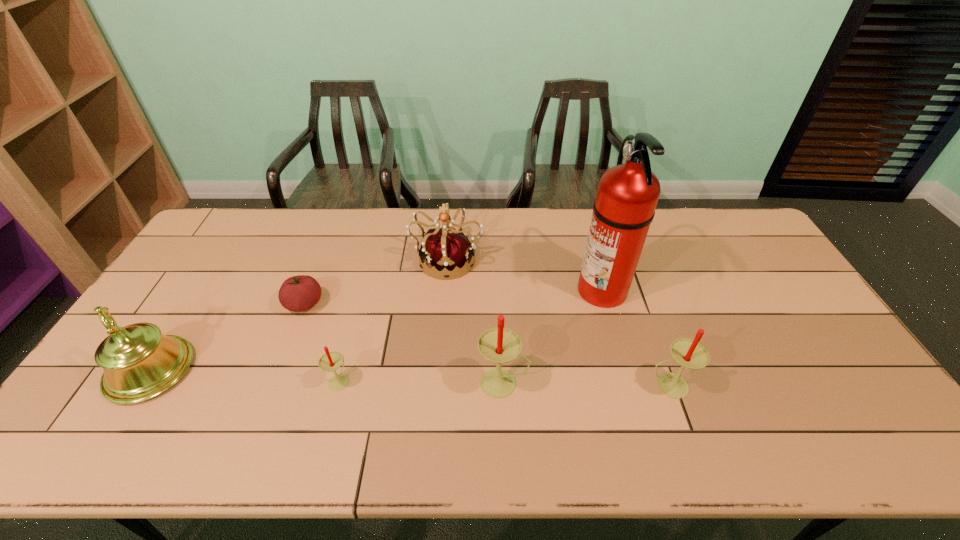
The height and width of the screenshot is (540, 960). Find the location of `vacant space that is in between the tiara and the fifth object from right to left`. vacant space that is in between the tiara and the fifth object from right to left is located at coordinates (394, 320).

This screenshot has height=540, width=960. I want to click on vacant area that lies between the second object from left to right and the third object from left to right, so click(322, 342).

At what (x,y) coordinates should I click in order to perform the action: click on vacant region between the fifth object from right to left and the tiara. Please return your answer as a coordinate pair (x, y). This screenshot has height=540, width=960. Looking at the image, I should click on (394, 320).

You are a GUI agent. You are given a task and a screenshot of the screen. Output one action in this format:
    pyautogui.click(x=<x>, y=<y>)
    Task: Click on the empty space between the second shortest object and the second candle from right to left
    This screenshot has width=960, height=540.
    Given the screenshot: What is the action you would take?
    pyautogui.click(x=421, y=382)

Find the location of a particular element. This screenshot has width=960, height=540. unoccupied position between the second tallest candle and the tiara is located at coordinates (558, 322).

You are a GUI agent. You are given a task and a screenshot of the screen. Output one action in this format:
    pyautogui.click(x=<x>, y=<y>)
    Task: Click on the free space between the rightmost candle and the bell
    Image resolution: width=960 pixels, height=540 pixels.
    Given the screenshot: What is the action you would take?
    pyautogui.click(x=410, y=378)

Locate an element on the screen. free spot between the shortest object and the shortest candle is located at coordinates tap(322, 342).

Locate an element on the screen. Image resolution: width=960 pixels, height=540 pixels. object that is the third closest to the rightmost candle is located at coordinates (448, 251).

Locate an element on the screen. object that stands as the second closest to the fifth object from right to left is located at coordinates [499, 345].

Locate which candle is the closest to the second shortest candle. Please provide its 2D coordinates. Your answer should be formatted as a tuple, i.e. [(x, y)], where the tuple contains the x and y coordinates of a point satisfying the conditions above.

[(499, 345)]